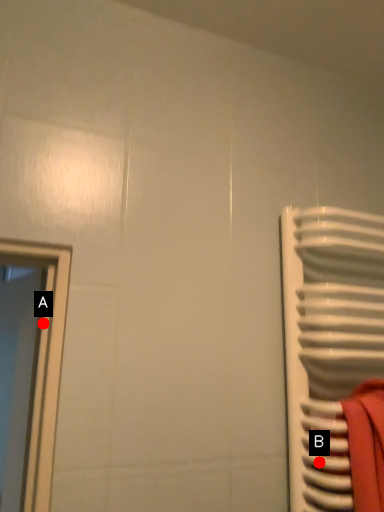
Question: Two points are circled on the image, labeled by A and B beside each circle. Which of the following is the farthest from the observer?

Choices:
 (A) A is further
 (B) B is further

Answer: (A)